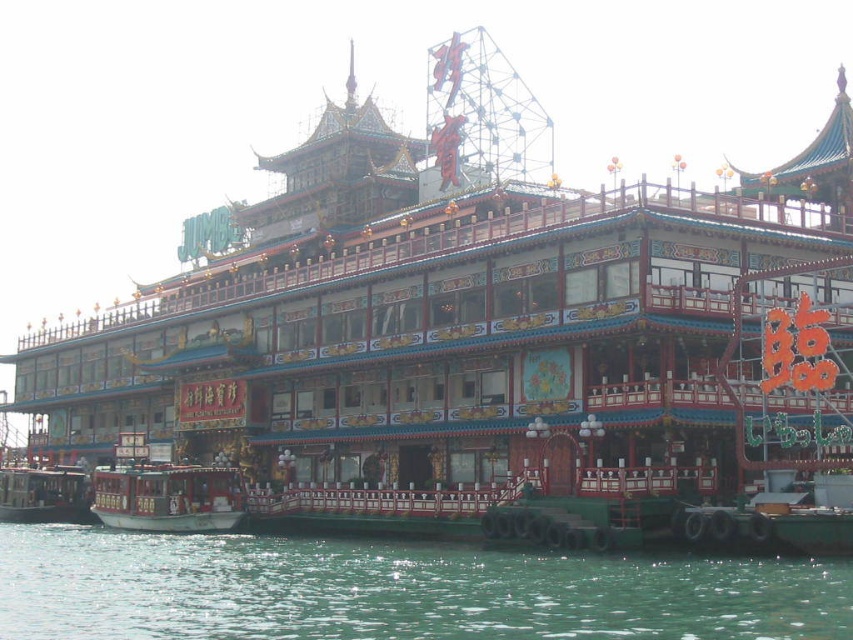
You are a tour guide leading a group to a boat at the waterfront. You see the green water at lower center and the black polished wood boat at lower left. How far apart are these two objects?

The green water at lower center and the black polished wood boat at lower left are 20.34 meters apart.

You are standing in front of the building and want to take a photo. There are two points marked on the building that you need to focus on. The first point is at coordinates point (x=612, y=596) and the second is at point (x=0, y=500). Which point should you focus on first to ensure it appears larger in your photo?

Point (x=612, y=596) is closer to the camera than point (x=0, y=500), so focusing on point (x=612, y=596) first will make it appear larger in the photo.

You are a tourist standing on the dock and see the green water at lower center and the black polished wood boat at lower left. Which object is wider from your perspective?

The green water at lower center might be wider than black polished wood boat at lower left.